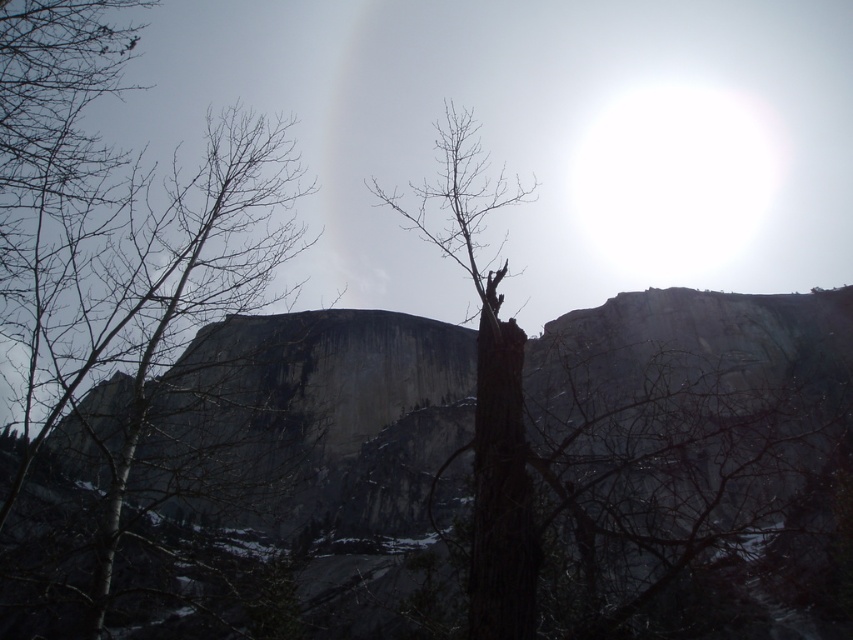
Question: Which of the following is the closest to the observer?

Choices:
 (A) granite cliff at center
 (B) brown rough bark tree at center
 (C) bare wood tree at left

Answer: (B)

Question: Among these objects, which one is nearest to the camera?

Choices:
 (A) bare wood tree at left
 (B) brown rough bark tree at center

Answer: (B)

Question: Does bare wood tree at left have a lesser width compared to brown rough bark tree at center?

Choices:
 (A) no
 (B) yes

Answer: (B)

Question: Does granite cliff at center appear under brown rough bark tree at center?

Choices:
 (A) no
 (B) yes

Answer: (B)

Question: Can you confirm if bare wood tree at left is smaller than brown rough bark tree at center?

Choices:
 (A) no
 (B) yes

Answer: (B)

Question: Which point is farther from the camera taking this photo?

Choices:
 (A) (265, 449)
 (B) (456, 193)

Answer: (A)